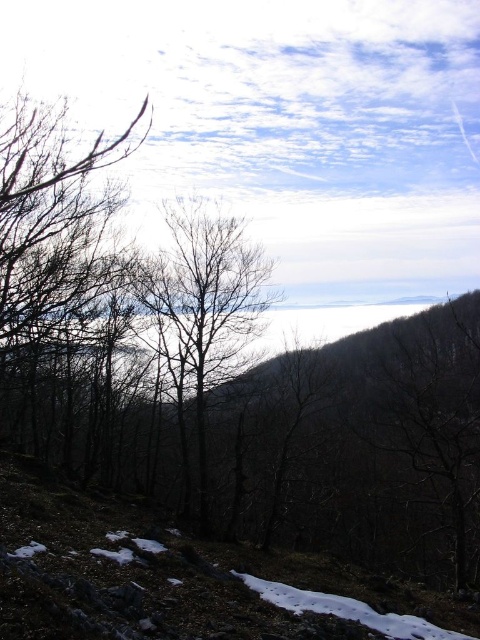
How distant is bare branches at left from brown/dry wood tree at center?

A: bare branches at left is 5.47 meters from brown/dry wood tree at center.

Can you confirm if bare branches at left is positioned to the right of brown/dry wood tree at center?

Incorrect, bare branches at left is not on the right side of brown/dry wood tree at center.

Who is more forward, (78, 166) or (242, 349)?

Point (78, 166) is in front.

In order to click on bare branches at left in this screenshot , I will do `click(55, 232)`.